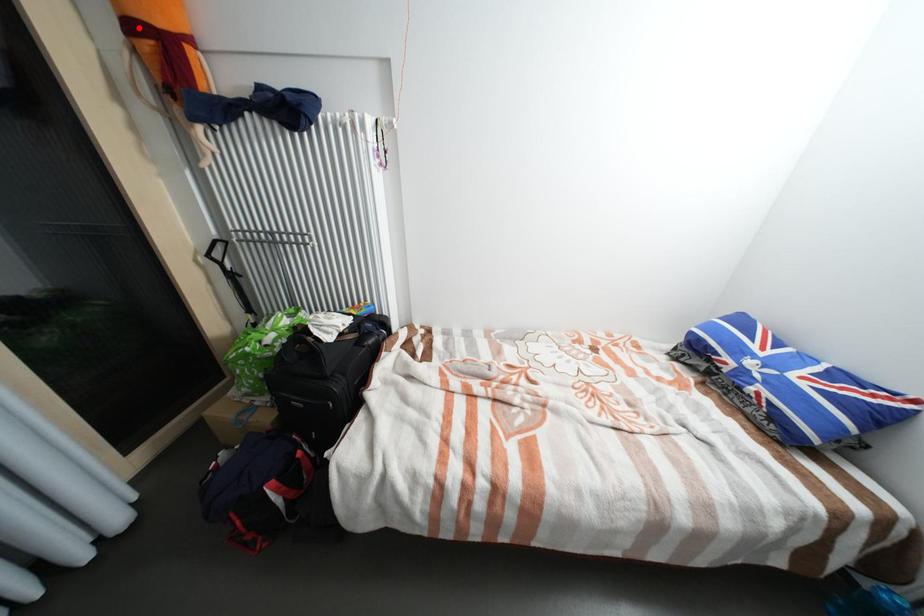
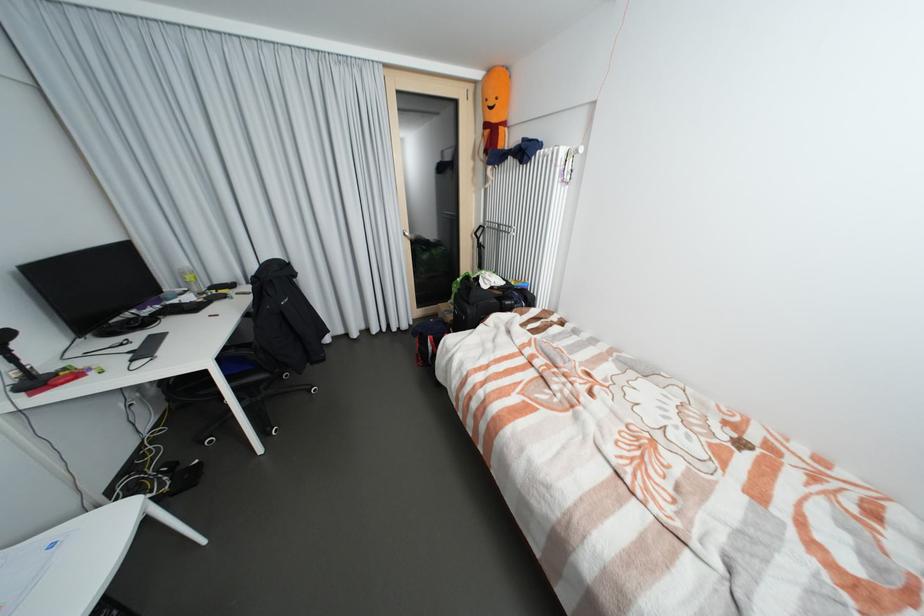
Question: I am providing you with two images of the same scene from different viewpoints. In image1, a red point is highlighted. Considering the same 3D point in image2, which of the following is correct?

Choices:
 (A) It is closer
 (B) It is farther

Answer: (A)